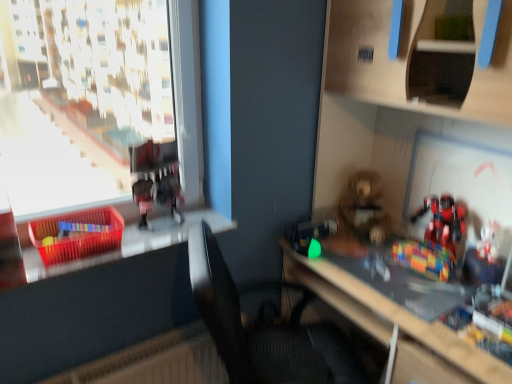
At what (x,y) coordinates should I click in order to perform the action: click on fuzzy brown teddy bear at center, the 2th toy from the left. Please return your answer as a coordinate pair (x, y). The width and height of the screenshot is (512, 384). Looking at the image, I should click on (360, 216).

The height and width of the screenshot is (384, 512). What do you see at coordinates (380, 113) in the screenshot? I see `wooden bookshelf at lower right` at bounding box center [380, 113].

The image size is (512, 384). What do you see at coordinates (129, 244) in the screenshot?
I see `translucent plastic basket at left` at bounding box center [129, 244].

This screenshot has height=384, width=512. Describe the element at coordinates (97, 99) in the screenshot. I see `transparent plastic window at left` at that location.

The image size is (512, 384). What are the coordinates of `fuzzy brown teddy bear at center, the third toy in the right-to-left sequence` in the screenshot? It's located at (360, 216).

From a real-world perspective, which is physically below, transparent plastic window at left or fuzzy brown teddy bear at center, the 2th toy from the left?

From a 3D spatial view, fuzzy brown teddy bear at center, the 2th toy from the left, is below.

Is transparent plastic window at left shorter than fuzzy brown teddy bear at center, the 2th toy from the left?

No, transparent plastic window at left is not shorter than fuzzy brown teddy bear at center, the 2th toy from the left.

Is point (170, 93) positioned before point (337, 225)?

Yes, it is in front of point (337, 225).

Is transparent plastic window at left oriented towards fuzzy brown teddy bear at center, the 2th toy from the left?

No, transparent plastic window at left is not turned towards fuzzy brown teddy bear at center, the 2th toy from the left.

Does black fabric chair at center come behind transparent plastic window at left?

That is False.

Does black fabric chair at center have a greater height compared to transparent plastic window at left?

Indeed, black fabric chair at center has a greater height compared to transparent plastic window at left.

Is black fabric chair at center inside or outside of transparent plastic window at left?

black fabric chair at center is outside transparent plastic window at left.

From the image's perspective, is black fabric chair at center over transparent plastic window at left?

No, from the image's perspective, black fabric chair at center is not over transparent plastic window at left.

In the scene shown: Is translucent plastic basket at left not close to transparent plastic window at left?

Yes.

Image resolution: width=512 pixels, height=384 pixels. I want to click on window sill directly beneath the transparent plastic window at left (from a real-world perspective), so click(129, 244).

Consider the image. Does translucent plastic basket at left have a smaller size compared to transparent plastic window at left?

Indeed, translucent plastic basket at left has a smaller size compared to transparent plastic window at left.

From the image's perspective, between white plastic toy at right, which appears as the fourth toy when viewed from the left, and shiny metallic robot at right, which ranks as the second toy in right-to-left order, which one is located above?

shiny metallic robot at right, which ranks as the second toy in right-to-left order, from the image's perspective.

Would you consider white plastic toy at right, marked as the first toy in a right-to-left arrangement, to be distant from shiny metallic robot at right, which ranks as the second toy in right-to-left order?

They are positioned close to each other.

This screenshot has width=512, height=384. I want to click on toy that is below the shiny metallic robot at right, the third toy in the left-to-right sequence (from the image's perspective), so click(489, 241).

Which object is positioned more to the right, metallic red robot at upper left, which is the 4th toy in right-to-left order, or fuzzy brown teddy bear at center, the 2th toy from the left?

fuzzy brown teddy bear at center, the 2th toy from the left, is more to the right.

How much distance is there between metallic red robot at upper left, which is the 4th toy in right-to-left order, and fuzzy brown teddy bear at center, the 2th toy from the left?

76.42 centimeters.

Considering the sizes of objects metallic red robot at upper left, which is the 4th toy in right-to-left order, and fuzzy brown teddy bear at center, the third toy in the right-to-left sequence, in the image provided, who is bigger, metallic red robot at upper left, which is the 4th toy in right-to-left order, or fuzzy brown teddy bear at center, the third toy in the right-to-left sequence,?

Bigger between the two is fuzzy brown teddy bear at center, the third toy in the right-to-left sequence.

Is metallic red robot at upper left, which is the 4th toy in right-to-left order, directly adjacent to fuzzy brown teddy bear at center, the third toy in the right-to-left sequence?

metallic red robot at upper left, which is the 4th toy in right-to-left order, is not next to fuzzy brown teddy bear at center, the third toy in the right-to-left sequence, and they're not touching.

Would you say wooden bookshelf at lower right is a long distance from translucent plastic crate at left?

Yes, wooden bookshelf at lower right and translucent plastic crate at left are located far from each other.

Does wooden bookshelf at lower right appear on the left side of translucent plastic crate at left?

No.

Does point (358, 153) come closer to viewer compared to point (63, 245)?

That is False.

From the image's perspective, which one is positioned higher, fuzzy brown teddy bear at center, the third toy in the right-to-left sequence, or white plastic toy at right, which appears as the fourth toy when viewed from the left?

fuzzy brown teddy bear at center, the third toy in the right-to-left sequence, appears higher in the image.

Between fuzzy brown teddy bear at center, the 2th toy from the left, and white plastic toy at right, which appears as the fourth toy when viewed from the left, which one has smaller width?

With smaller width is white plastic toy at right, which appears as the fourth toy when viewed from the left.

Does point (361, 195) come behind point (497, 226)?

Yes, point (361, 195) is behind point (497, 226).

Considering their positions, is fuzzy brown teddy bear at center, the 2th toy from the left, located in front of or behind white plastic toy at right, marked as the first toy in a right-to-left arrangement?

fuzzy brown teddy bear at center, the 2th toy from the left, is positioned farther from the viewer than white plastic toy at right, marked as the first toy in a right-to-left arrangement.

The height and width of the screenshot is (384, 512). I want to click on window on the left side of fuzzy brown teddy bear at center, the 2th toy from the left, so click(97, 99).

Identify the location of window behind the black fabric chair at center. Image resolution: width=512 pixels, height=384 pixels. (97, 99).

Which object lies further to the anchor point translucent plastic basket at left, black fabric chair at center or metallic red robot at upper left, placed as the 1th toy when sorted from left to right?

black fabric chair at center lies further to translucent plastic basket at left than the other object.

Which object lies further to the anchor point fuzzy brown teddy bear at center, the third toy in the right-to-left sequence, transparent plastic window at left or white plastic toy at right, marked as the first toy in a right-to-left arrangement?

The object further to fuzzy brown teddy bear at center, the third toy in the right-to-left sequence, is transparent plastic window at left.

Looking at the image, which one is located further to black fabric chair at center, translucent plastic basket at left or metallic red robot at upper left, which is the 4th toy in right-to-left order?

Based on the image, metallic red robot at upper left, which is the 4th toy in right-to-left order, appears to be further to black fabric chair at center.

Which object lies nearer to the anchor point transparent plastic window at left, wooden bookshelf at lower right or metallic red robot at upper left, which is the 4th toy in right-to-left order?

Among the two, metallic red robot at upper left, which is the 4th toy in right-to-left order, is located nearer to transparent plastic window at left.

Estimate the real-world distances between objects in this image. Which object is closer to translucent plastic crate at left, white plastic toy at right, which appears as the fourth toy when viewed from the left, or shiny metallic robot at right, which ranks as the second toy in right-to-left order?

Among the two, shiny metallic robot at right, which ranks as the second toy in right-to-left order, is located nearer to translucent plastic crate at left.

From the image, which object appears to be farther from transparent plastic window at left, metallic red robot at upper left, which is the 4th toy in right-to-left order, or shiny metallic robot at right, the third toy in the left-to-right sequence?

shiny metallic robot at right, the third toy in the left-to-right sequence.

Which object lies nearer to the anchor point transparent plastic window at left, translucent plastic basket at left or white plastic toy at right, marked as the first toy in a right-to-left arrangement?

translucent plastic basket at left.

Estimate the real-world distances between objects in this image. Which object is further from metallic red robot at upper left, which is the 4th toy in right-to-left order, translucent plastic basket at left or fuzzy brown teddy bear at center, the 2th toy from the left?

Based on the image, fuzzy brown teddy bear at center, the 2th toy from the left, appears to be further to metallic red robot at upper left, which is the 4th toy in right-to-left order.

The width and height of the screenshot is (512, 384). I want to click on bookshelf between black fabric chair at center and white plastic toy at right, marked as the first toy in a right-to-left arrangement, so (380, 113).

Identify the location of chair between metallic red robot at upper left, placed as the 1th toy when sorted from left to right, and white plastic toy at right, marked as the first toy in a right-to-left arrangement, in the horizontal direction. Image resolution: width=512 pixels, height=384 pixels. [x=265, y=329].

Where is `bookshelf located between translucent plastic crate at left and white plastic toy at right, marked as the first toy in a right-to-left arrangement, in the left-right direction`? The height and width of the screenshot is (384, 512). bookshelf located between translucent plastic crate at left and white plastic toy at right, marked as the first toy in a right-to-left arrangement, in the left-right direction is located at coordinates (380, 113).

The width and height of the screenshot is (512, 384). I want to click on crate between transparent plastic window at left and translucent plastic basket at left in the up-down direction, so click(x=77, y=236).